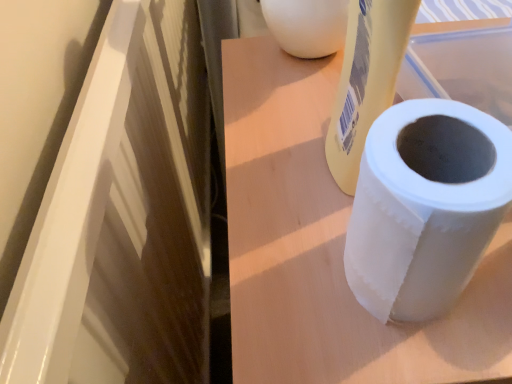
Question: Does white matte paper towel roll at center lie in front of white matte toilet paper at right?

Choices:
 (A) no
 (B) yes

Answer: (A)

Question: Would you say white matte paper towel roll at center contains white matte toilet paper at right?

Choices:
 (A) yes
 (B) no

Answer: (B)

Question: Is white matte paper towel roll at center taller than white matte toilet paper at right?

Choices:
 (A) yes
 (B) no

Answer: (A)

Question: Is white matte paper towel roll at center looking in the opposite direction of white matte toilet paper at right?

Choices:
 (A) yes
 (B) no

Answer: (B)

Question: Does white matte paper towel roll at center come behind white matte toilet paper at right?

Choices:
 (A) yes
 (B) no

Answer: (A)

Question: Is white matte paper towel roll at center not inside white matte toilet paper at right?

Choices:
 (A) yes
 (B) no

Answer: (A)

Question: Is white matte toilet paper at right bigger than white matte paper towel roll at center?

Choices:
 (A) no
 (B) yes

Answer: (A)

Question: From the image's perspective, does white matte toilet paper at right appear higher than white matte paper towel roll at center?

Choices:
 (A) yes
 (B) no

Answer: (A)

Question: From the image's perspective, would you say white matte toilet paper at right is shown under white matte paper towel roll at center?

Choices:
 (A) yes
 (B) no

Answer: (B)

Question: Can white matte paper towel roll at center be found inside white matte toilet paper at right?

Choices:
 (A) no
 (B) yes

Answer: (A)

Question: From a real-world perspective, is white matte toilet paper at right on white matte paper towel roll at center?

Choices:
 (A) yes
 (B) no

Answer: (A)

Question: Can we say white matte toilet paper at right lies outside white matte paper towel roll at center?

Choices:
 (A) no
 (B) yes

Answer: (B)

Question: From a real-world perspective, is white matte paper towel roll at center positioned above or below white matte toilet paper at right?

Choices:
 (A) below
 (B) above

Answer: (A)